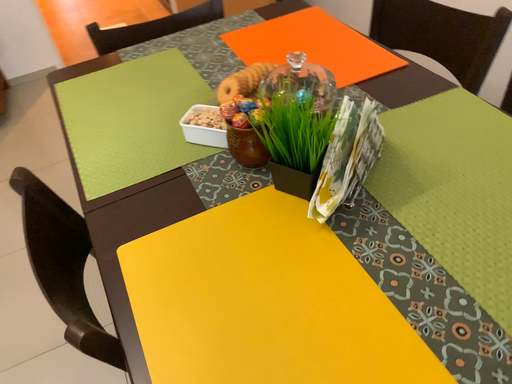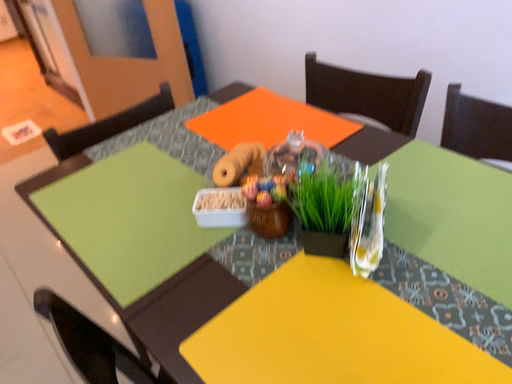
Question: Which way did the camera rotate in the video?

Choices:
 (A) rotated upward
 (B) rotated downward

Answer: (A)